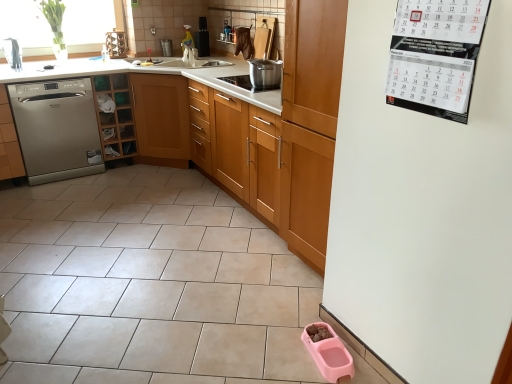
Question: Would you say white paper calendar at upper right is to the left or to the right of stainless steel pot at center in the picture?

Choices:
 (A) right
 (B) left

Answer: (A)

Question: From a real-world perspective, is white paper calendar at upper right physically located above or below stainless steel pot at center?

Choices:
 (A) below
 (B) above

Answer: (B)

Question: Considering the real-world distances, which object is farthest from the wooden cabinet at center, which is the third cabinetry in left-to-right order?

Choices:
 (A) wooden cabinet at left, the second cabinetry positioned from the right
 (B) stainless steel pot at center
 (C) white ceramic sink at upper center
 (D) pink plastic pet food bowl at lower right
 (E) white paper calendar at upper right

Answer: (A)

Question: Which is farther from the wooden cabinet at left, which ranks as the 2th cabinetry in left-to-right order?

Choices:
 (A) white ceramic sink at upper center
 (B) satin silver dishwasher at left, which is counted as the 3th cabinetry, starting from the right
 (C) pink plastic pet food bowl at lower right
 (D) satin silver dishwasher at left
 (E) stainless steel pot at center

Answer: (C)